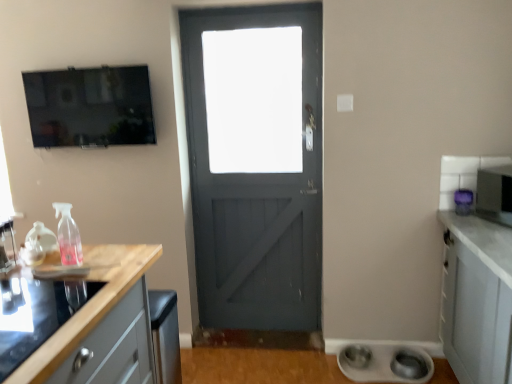
Question: Would you say white matte bowls at lower right, which appears as the 3th appliance when viewed from the top, is inside or outside matte black tv at upper left?

Choices:
 (A) inside
 (B) outside

Answer: (B)

Question: From a real-world perspective, relative to matte black tv at upper left, is white matte bowls at lower right, which appears as the 3th appliance when viewed from the top, vertically above or below?

Choices:
 (A) below
 (B) above

Answer: (A)

Question: Which of these objects is positioned closest to the metallic silver microwave at right, which appears as the 1th appliance when viewed from the top?

Choices:
 (A) matte black tv at upper left
 (B) purple plastic microwave at right, the 2th appliance positioned from the left
 (C) pink translucent spray bottle at left
 (D) wooden at left
 (E) white matte bowls at lower right, positioned as the 1th appliance in left-to-right order

Answer: (B)

Question: Considering the real-world distances, which object is farthest from the white matte bowls at lower right, the 3th appliance viewed from the right?

Choices:
 (A) pink translucent spray bottle at left
 (B) metallic silver microwave at right, which appears as the 1th appliance when viewed from the top
 (C) matte black tv at upper left
 (D) wooden at left
 (E) purple plastic microwave at right, which is the 2th appliance in right-to-left order

Answer: (C)